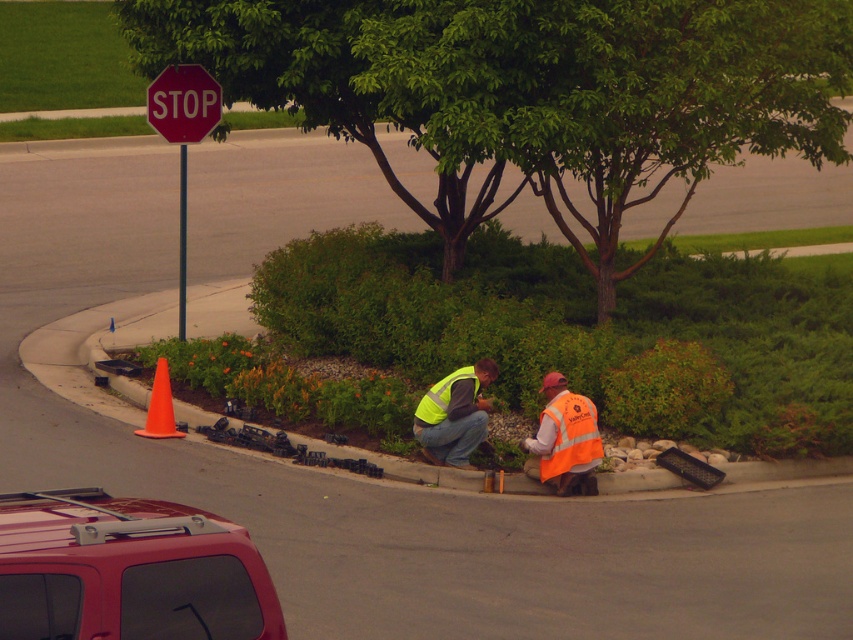
Question: Does orange reflective vest at lower right have a greater width compared to red matte stop sign at upper left?

Choices:
 (A) no
 (B) yes

Answer: (A)

Question: Which point appears closest to the camera in this image?

Choices:
 (A) (508, 115)
 (B) (433, 458)
 (C) (148, 426)

Answer: (B)

Question: Which of these objects is positioned farthest from the orange reflective vest at lower right?

Choices:
 (A) metallic red car at lower left
 (B) green leafy tree at upper center
 (C) high-visibility yellow vest at center
 (D) yellow reflective safety vest at center

Answer: (A)

Question: Which object is the farthest from the high-visibility yellow vest at center?

Choices:
 (A) yellow reflective safety vest at center
 (B) green leafy tree at upper center
 (C) orange reflective vest at lower right
 (D) orange plastic traffic cone at lower left

Answer: (B)

Question: Where is red matte stop sign at upper left located in relation to orange plastic traffic cone at lower left in the image?

Choices:
 (A) below
 (B) above

Answer: (B)

Question: Is high-visibility yellow vest at center thinner than orange plastic traffic cone at lower left?

Choices:
 (A) no
 (B) yes

Answer: (A)